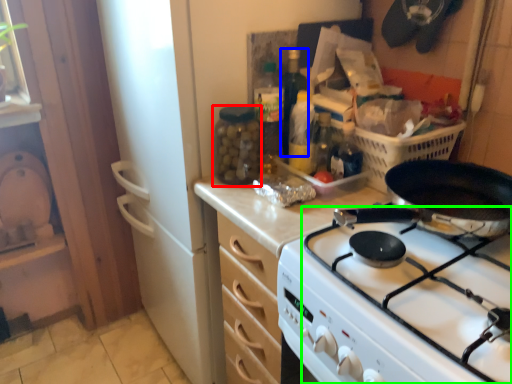
Question: Which object is positioned farthest from bottle (highlighted by a red box)? Select from bottle (highlighted by a blue box) and gas stove (highlighted by a green box).

Choices:
 (A) bottle
 (B) gas stove

Answer: (B)